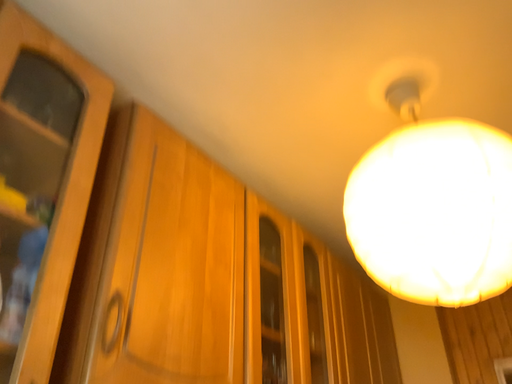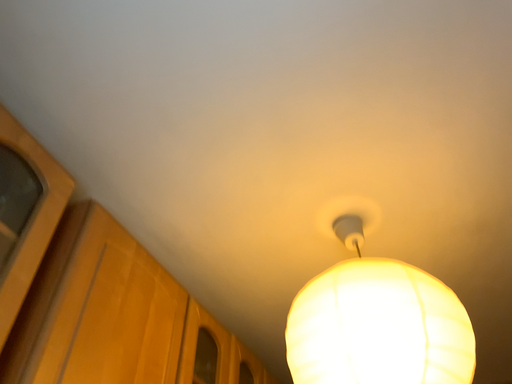
Question: How did the camera likely rotate when shooting the video?

Choices:
 (A) rotated downward
 (B) rotated upward

Answer: (B)